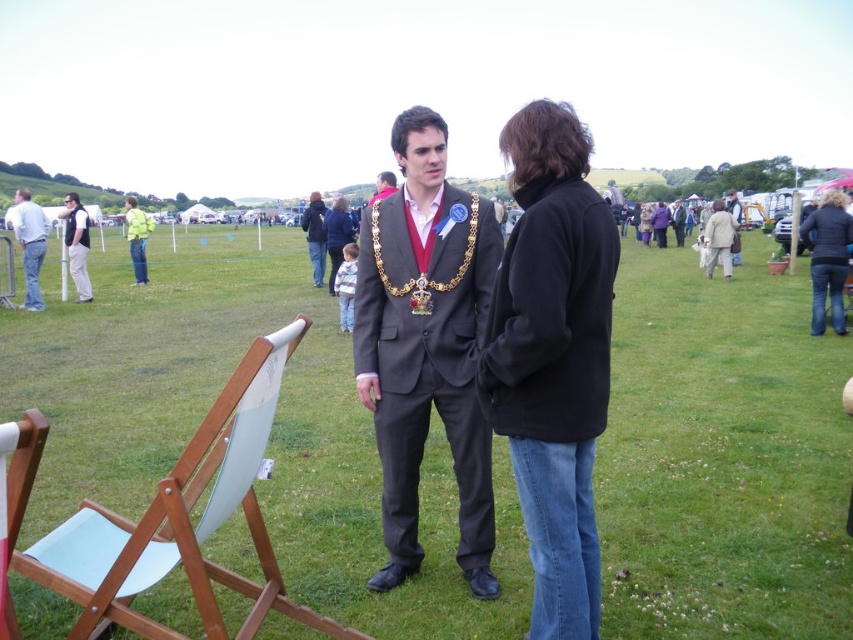
You are standing at the community fair and want to know which of the two points, point (25, 268) or point (317, 209), is closer to you. Can you determine this based on their positions?

Point (25, 268) is closer to the viewer than point (317, 209), so yes, you can determine that point (25, 268) is closer.

What is the location of the point with coordinates (552, 358) in the image?

The point with coordinates (552, 358) is located on the black fleece jacket at center.

You are a photographer at the event and need to capture both the light blue denim jeans at left and the dark blue jacket at center in a single frame. Based on their positions, which one should you focus on first to ensure both are in focus?

The light blue denim jeans at left is below dark blue jacket at center, so focusing on the dark blue jacket at center first will ensure both are in focus as they are vertically aligned.